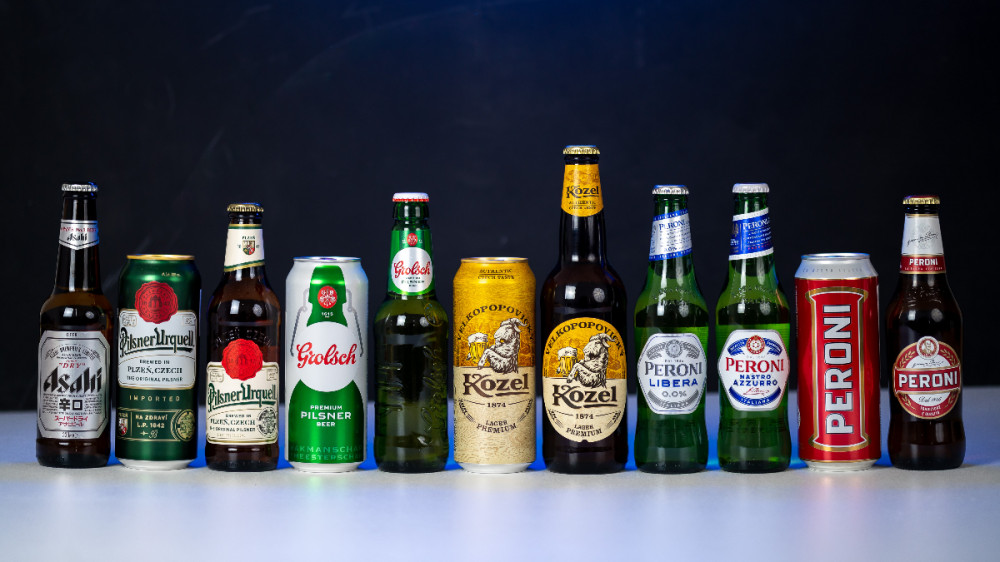
This screenshot has width=1000, height=562. Find the location of `glass bottle`. glass bottle is located at coordinates (78, 379), (434, 362), (598, 359), (661, 357), (776, 355), (931, 355).